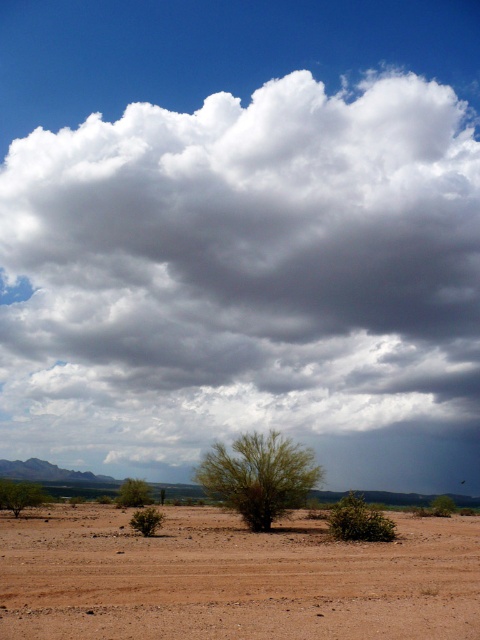
Question: Which point appears farthest from the camera in this image?

Choices:
 (A) (408, 388)
 (B) (414, 602)
 (C) (240, 497)

Answer: (A)

Question: Can you confirm if green leafy bush at lower right is positioned above green leafy bush at lower left?

Choices:
 (A) yes
 (B) no

Answer: (B)

Question: Is cloudy white cloud at upper center positioned at the back of brown sandy dirt field at lower center?

Choices:
 (A) yes
 (B) no

Answer: (A)

Question: Is green leafy bush at lower right positioned before green leafy bush at lower center?

Choices:
 (A) yes
 (B) no

Answer: (A)

Question: Which of the following is the farthest from the observer?

Choices:
 (A) brown sandy dirt field at lower center
 (B) cloudy white cloud at upper center
 (C) green leafy bush at center
 (D) green leafy bush at lower right

Answer: (B)

Question: Which object appears farthest from the camera in this image?

Choices:
 (A) green leafy bush at lower left
 (B) green leafy bush at lower center

Answer: (B)